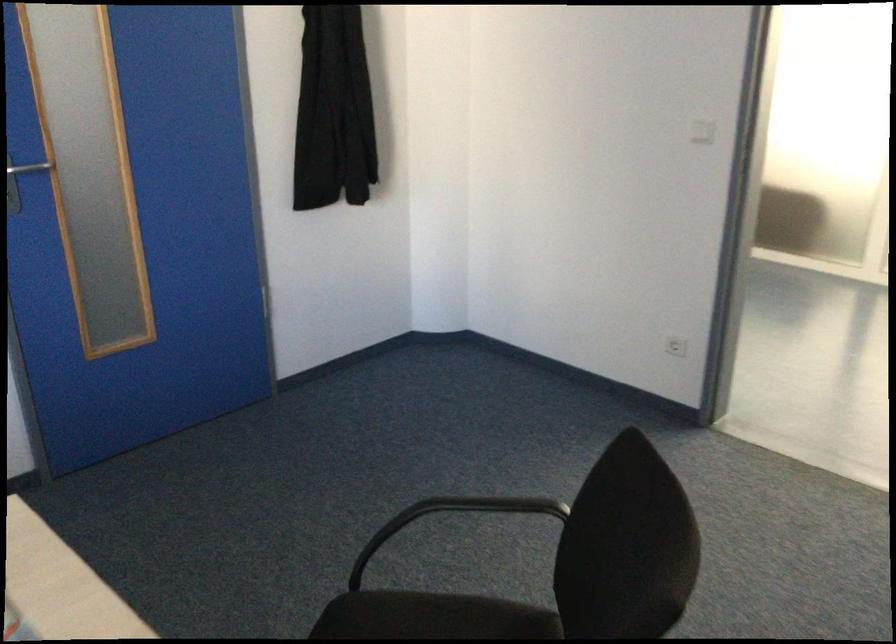
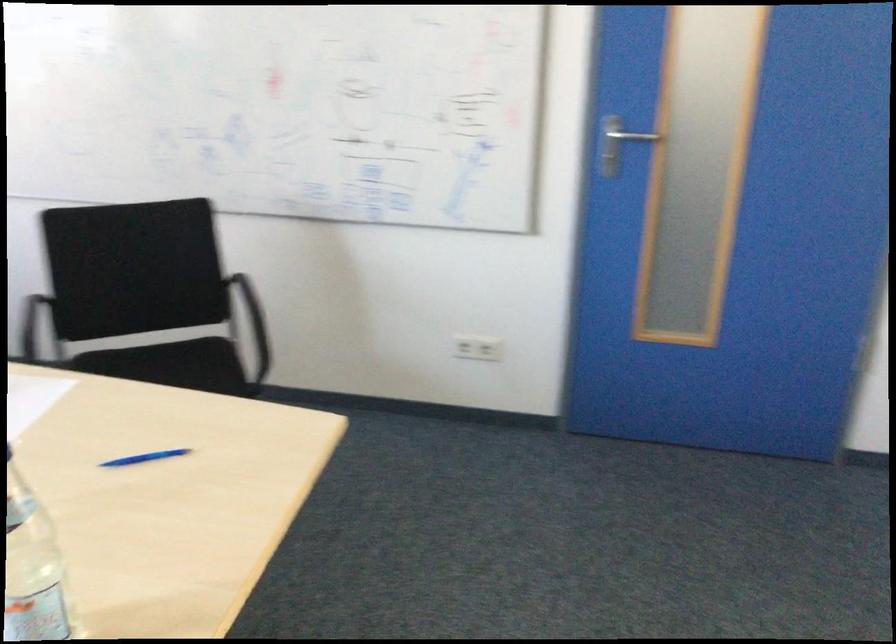
Question: The camera is either moving clockwise (left) or counter-clockwise (right) around the object. The first image is from the beginning of the video and the second image is from the end. Is the camera moving left or right when shooting the video?

Choices:
 (A) Left
 (B) Right

Answer: (B)